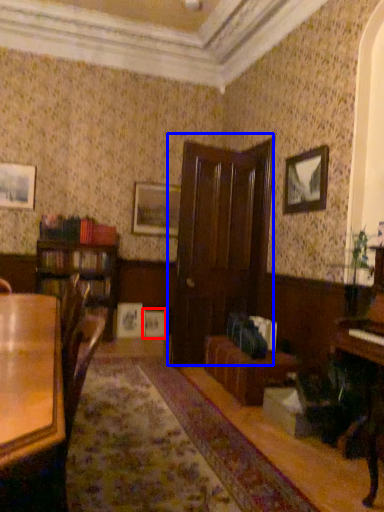
Question: Which object appears farthest to the camera in this image, picture frame (highlighted by a red box) or door (highlighted by a blue box)?

Choices:
 (A) picture frame
 (B) door

Answer: (A)